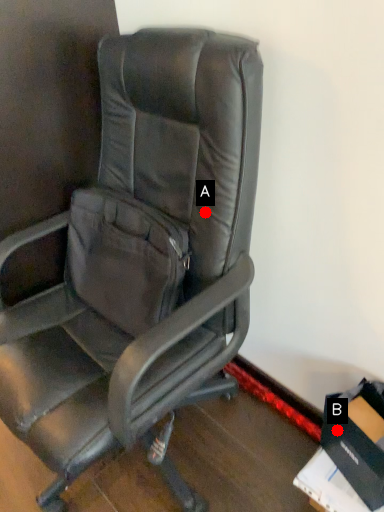
Question: Two points are circled on the image, labeled by A and B beside each circle. Which point appears farthest from the camera in this image?

Choices:
 (A) A is further
 (B) B is further

Answer: (B)